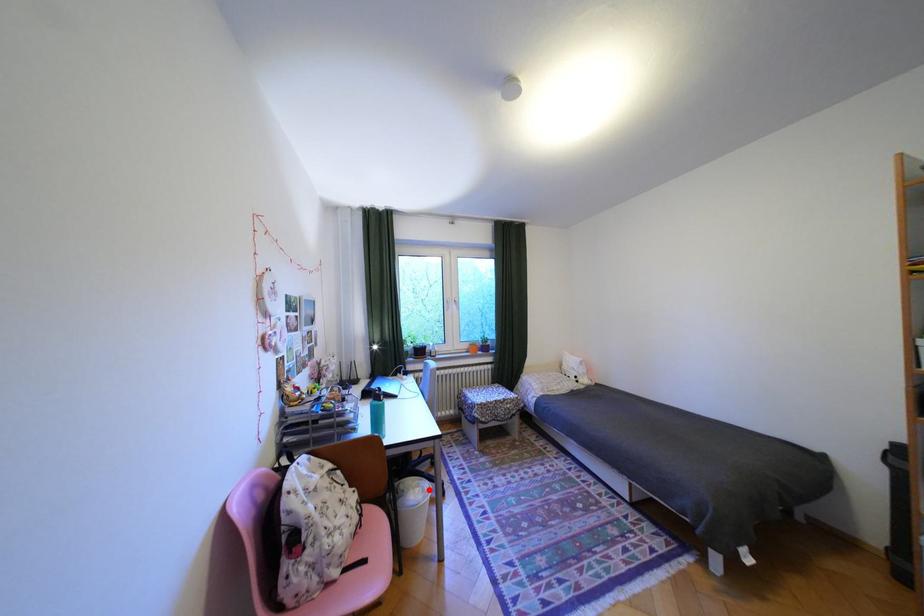
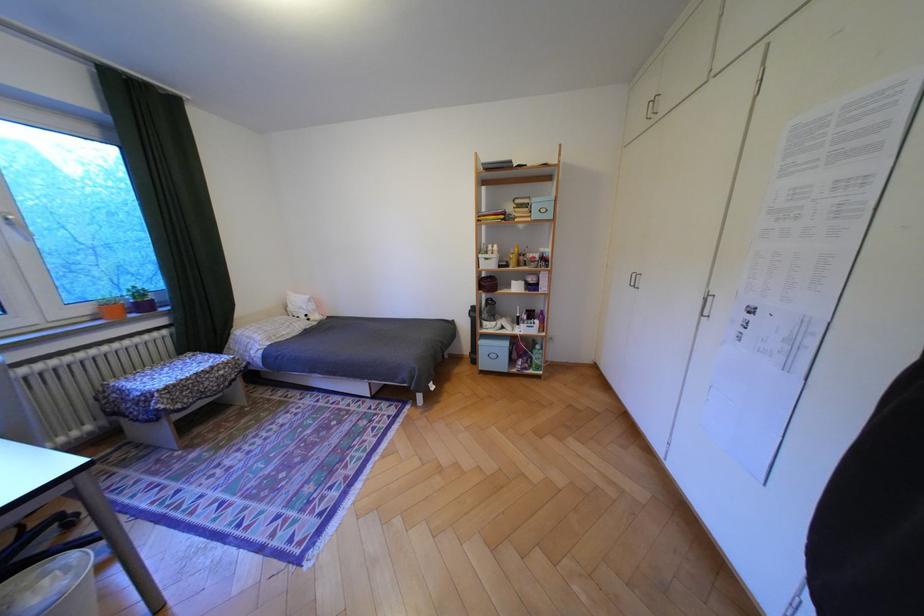
Where in the second image is the point corresponding to the highlighted location from the first image?

(56, 582)